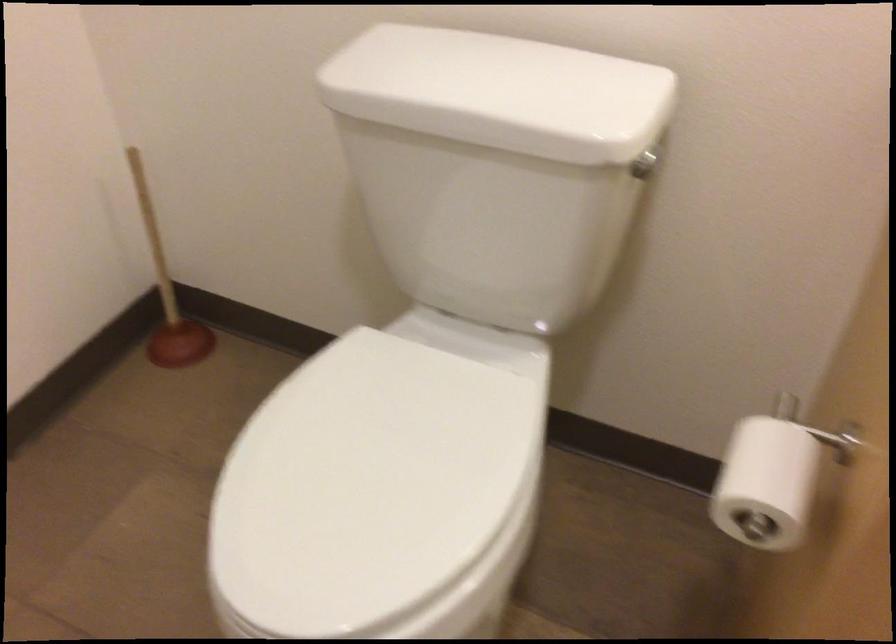
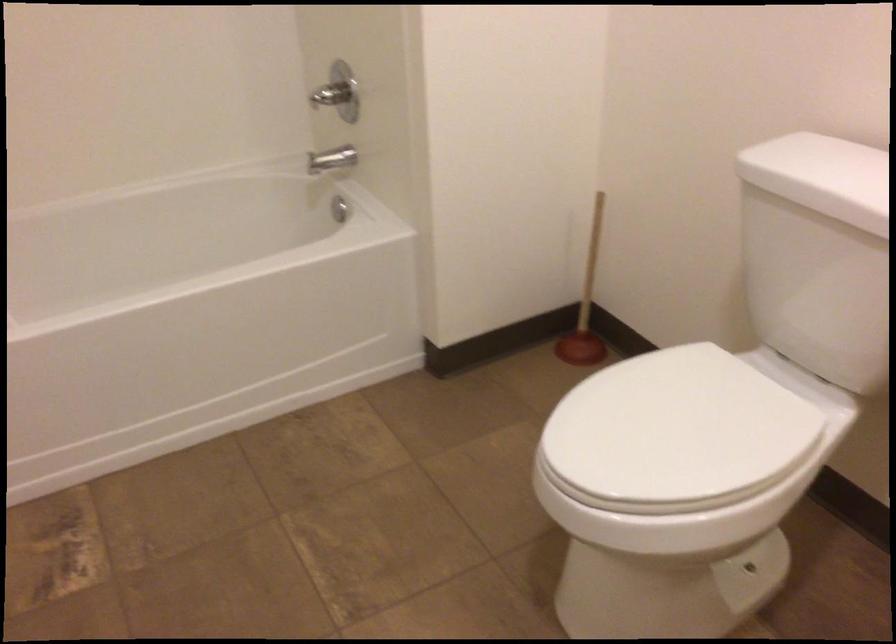
Question: The camera is either moving clockwise (left) or counter-clockwise (right) around the object. The first image is from the beginning of the video and the second image is from the end. Is the camera moving left or right when shooting the video?

Choices:
 (A) Left
 (B) Right

Answer: (B)